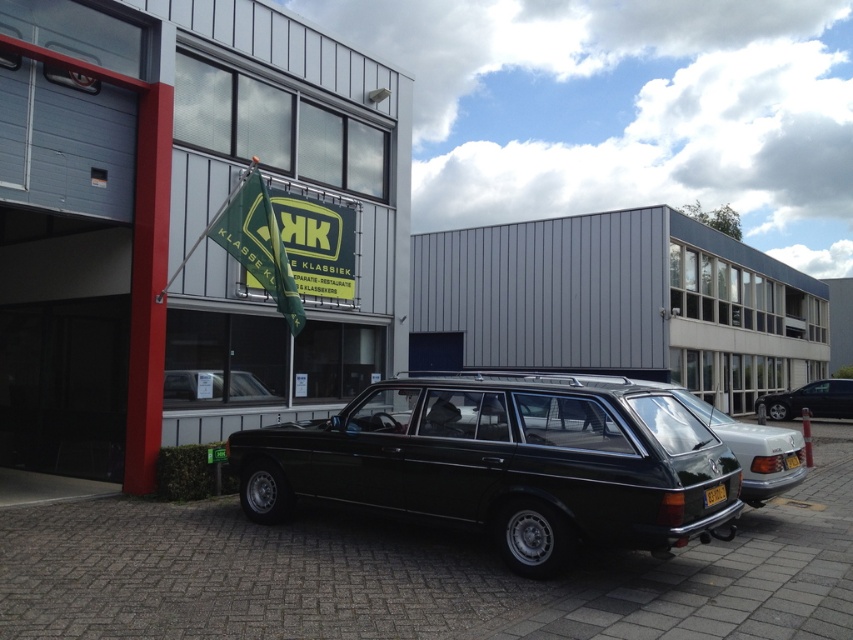
You are a delivery driver who needs to park your vehicle in a spot that can accommodate a car with a 1.8 meter height. Based on the scene, can you safely park your vehicle next to the shiny black station wagon at center without hitting the yellow matte license plate at rear?

The shiny black station wagon at center is located above the yellow matte license plate at rear, so there should be enough vertical clearance for your vehicle to park next to it safely.